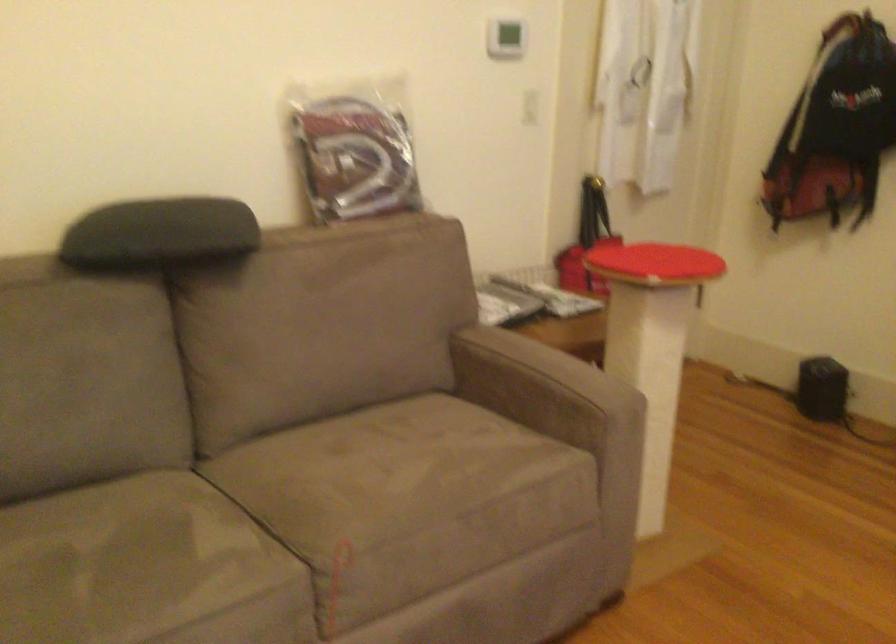
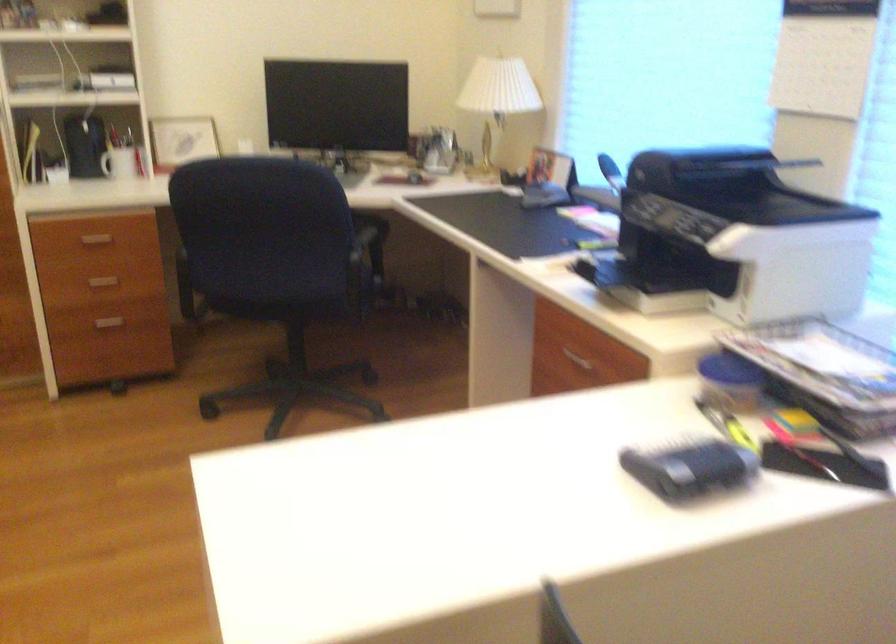
The first image is from the beginning of the video and the second image is from the end. How did the camera likely rotate when shooting the video?

The rotation direction of the camera is right-down.